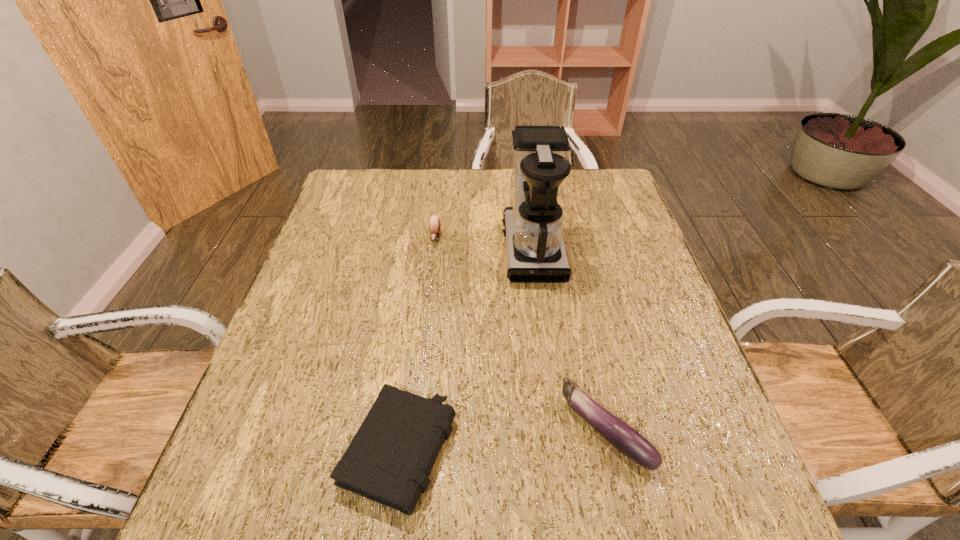
The height and width of the screenshot is (540, 960). Find the location of `object that is at the near edge`. object that is at the near edge is located at coordinates coord(389,460).

The height and width of the screenshot is (540, 960). I want to click on object present at the right edge, so click(x=627, y=440).

The image size is (960, 540). Identify the location of vacant space at the far edge. (403, 197).

Identify the location of free space at the near edge of the desktop. (420, 528).

I want to click on vacant region at the left edge, so click(x=289, y=346).

The width and height of the screenshot is (960, 540). In order to click on free space at the right edge of the desktop in this screenshot , I will do `click(622, 226)`.

Image resolution: width=960 pixels, height=540 pixels. In the image, there is a desktop. Identify the location of vacant region at the far left corner. (372, 181).

Find the location of a particular element. The image size is (960, 540). free space between the coffee maker and the Bible is located at coordinates (466, 350).

Locate an element on the screen. free space between the escargot and the coffee maker is located at coordinates (484, 243).

Locate an element on the screen. This screenshot has height=540, width=960. vacant space that is in between the eggplant and the escargot is located at coordinates (520, 333).